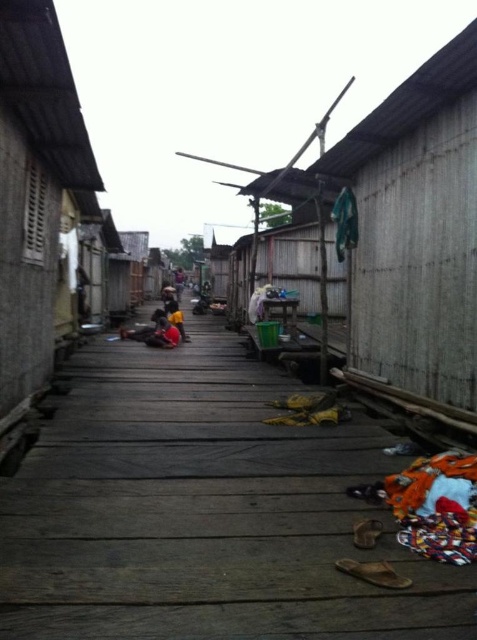
Can you confirm if wooden hut at right is shorter than dark blue fabric at center?

No.

Who is positioned more to the left, wooden hut at right or dark blue fabric at center?

Positioned to the left is dark blue fabric at center.

I want to click on wooden hut at right, so click(404, 236).

Between wooden planks at center and wooden hut at right, which one has more height?

wooden hut at right

Can you confirm if wooden planks at center is wider than wooden hut at right?

Indeed, wooden planks at center has a greater width compared to wooden hut at right.

The height and width of the screenshot is (640, 477). In order to click on wooden planks at center in this screenshot , I will do `click(204, 512)`.

Where is `wooden planks at center`? The height and width of the screenshot is (640, 477). wooden planks at center is located at coordinates (204, 512).

Based on the photo, which is below, dark brown fabric at center or dark blue fabric at center?

dark brown fabric at center

Who is shorter, dark brown fabric at center or dark blue fabric at center?

dark brown fabric at center

The image size is (477, 640). What do you see at coordinates (176, 317) in the screenshot? I see `dark brown fabric at center` at bounding box center [176, 317].

The image size is (477, 640). I want to click on dark brown fabric at center, so click(x=176, y=317).